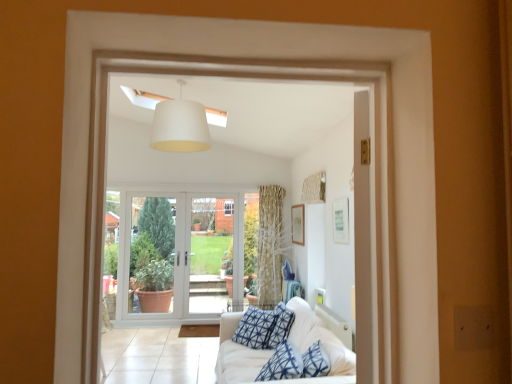
The image size is (512, 384). In order to click on wooden picture frame at upper right, which is the 2th picture frame from right to left in this screenshot , I will do `click(298, 224)`.

What do you see at coordinates (341, 221) in the screenshot? I see `wooden picture frame at upper center, which is the 1th picture frame from front to back` at bounding box center [341, 221].

You are a GUI agent. You are given a task and a screenshot of the screen. Output one action in this format:
    pyautogui.click(x=<x>, y=<y>)
    Task: Click on the white glass door at center
    
    Given the screenshot: What is the action you would take?
    pyautogui.click(x=180, y=256)

What do you see at coordinates (236, 209) in the screenshot? The height and width of the screenshot is (384, 512). I see `white plastic window frame at center` at bounding box center [236, 209].

This screenshot has width=512, height=384. Identify the location of wooden picture frame at upper right, which is the 2th picture frame in front-to-back order. (298, 224).

What's the angular difference between white glass door at center and patterned fabric curtain at upper right's facing directions?

The angle between the facing direction of white glass door at center and the facing direction of patterned fabric curtain at upper right is 89.2 degrees.

Between white glass door at center and patterned fabric curtain at upper right, which one is positioned in front?

patterned fabric curtain at upper right is more forward.

From the image's perspective, which object appears higher, white glass door at center or patterned fabric curtain at upper right?

patterned fabric curtain at upper right, from the image's perspective.

From the image's perspective, is white matte lampshade at upper center located above white glass door at center, the 1th screen door positioned from the right?

Yes, from the image's perspective, white matte lampshade at upper center is on top of white glass door at center, the 1th screen door positioned from the right.

From the picture: How different are the orientations of white matte lampshade at upper center and white glass door at center, which is counted as the 2th screen door, starting from the left, in degrees?

The angle between the facing direction of white matte lampshade at upper center and the facing direction of white glass door at center, which is counted as the 2th screen door, starting from the left, is 87.7 degrees.

This screenshot has height=384, width=512. In order to click on light fixture that is above the white glass door at center, which is counted as the 2th screen door, starting from the left (from the image's perspective) in this screenshot , I will do `click(180, 126)`.

Based on the photo, which is nearer, [203,130] or [207,280]?

Clearly, point [203,130] is closer to the camera than point [207,280].

From a real-world perspective, is white glass door at center physically located above or below white glass door at center, the 1th screen door positioned from the right?

white glass door at center is below white glass door at center, the 1th screen door positioned from the right.

Considering the sizes of white glass door at center and white glass door at center, which is counted as the 2th screen door, starting from the left, in the image, is white glass door at center wider or thinner than white glass door at center, which is counted as the 2th screen door, starting from the left,?

In the image, white glass door at center appears to be wider than white glass door at center, which is counted as the 2th screen door, starting from the left.

In the scene shown: Is white glass door at center bigger or smaller than white glass door at center, which is counted as the 2th screen door, starting from the left?

In the image, white glass door at center appears to be larger than white glass door at center, which is counted as the 2th screen door, starting from the left.

Between patterned fabric curtain at upper right and white matte lampshade at upper center, which one appears on the left side from the viewer's perspective?

white matte lampshade at upper center.

Would you say patterned fabric curtain at upper right contains white matte lampshade at upper center?

That's incorrect, white matte lampshade at upper center is not inside patterned fabric curtain at upper right.

Does patterned fabric curtain at upper right come behind white matte lampshade at upper center?

Yes, patterned fabric curtain at upper right is further from the viewer.

From the image's perspective, who appears lower, patterned fabric curtain at upper right or white matte lampshade at upper center?

From the image's view, patterned fabric curtain at upper right is below.

Which of these two, wooden picture frame at upper right, marked as the 1th picture frame in a left-to-right arrangement, or white glass door at center, stands shorter?

wooden picture frame at upper right, marked as the 1th picture frame in a left-to-right arrangement, is shorter.

From the picture: Would you say wooden picture frame at upper right, which is the 2th picture frame in front-to-back order, is outside white glass door at center?

Yes, wooden picture frame at upper right, which is the 2th picture frame in front-to-back order, is located beyond the bounds of white glass door at center.

This screenshot has height=384, width=512. In order to click on door lying behind the wooden picture frame at upper right, which is the 2th picture frame from right to left in this screenshot , I will do `click(180, 256)`.

Can you tell me how much wooden picture frame at upper right, which is the 2th picture frame in front-to-back order, and white glass door at center differ in facing direction?

89 degrees.

From a real-world perspective, is wooden picture frame at upper right, which is the 2th picture frame in front-to-back order, on top of patterned fabric curtain at upper right?

Actually, wooden picture frame at upper right, which is the 2th picture frame in front-to-back order, is physically below patterned fabric curtain at upper right in the real world.

Which is behind, point (298, 230) or point (317, 176)?

The point (298, 230) is behind.

Consider the image. Is wooden picture frame at upper right, the first picture frame from the back, aimed at patterned fabric curtain at upper right?

No, wooden picture frame at upper right, the first picture frame from the back, is not oriented towards patterned fabric curtain at upper right.

Find the location of `picture frame that is under the white plastic window frame at center (from a real-world perspective)`. picture frame that is under the white plastic window frame at center (from a real-world perspective) is located at coordinates (298, 224).

Between wooden picture frame at upper right, marked as the 1th picture frame in a left-to-right arrangement, and white plastic window frame at center, which one has less height?

wooden picture frame at upper right, marked as the 1th picture frame in a left-to-right arrangement, is shorter.

From the picture: From the image's perspective, which one is positioned lower, wooden picture frame at upper right, the first picture frame from the back, or white plastic window frame at center?

From the image's view, wooden picture frame at upper right, the first picture frame from the back, is below.

The height and width of the screenshot is (384, 512). In the image, there is a patterned fabric curtain at upper right. Identify the location of door below it (from the image's perspective). (180, 256).

Where is `light fixture that is on the right side of white glass door at center, which is counted as the 2th screen door, starting from the left`? light fixture that is on the right side of white glass door at center, which is counted as the 2th screen door, starting from the left is located at coordinates (180, 126).

When comparing their distances from white fabric couch at lower right, does white glass door at center or patterned fabric curtain at upper right seem further?

white glass door at center lies further to white fabric couch at lower right than the other object.

Based on the photo, looking at the image, which one is located closer to white fabric couch at lower right, patterned fabric curtain at upper right or white glass door at center?

Based on the image, patterned fabric curtain at upper right appears to be nearer to white fabric couch at lower right.

Estimate the real-world distances between objects in this image. Which object is closer to white matte lampshade at upper center, clear glass door at center, which ranks as the second screen door in right-to-left order, or wooden picture frame at upper center, placed as the 2th picture frame when sorted from back to front?

Based on the image, wooden picture frame at upper center, placed as the 2th picture frame when sorted from back to front, appears to be nearer to white matte lampshade at upper center.

Looking at the image, which one is located closer to white plastic window frame at center, wooden picture frame at upper right, the first picture frame from the back, or patterned fabric curtain at upper right?

wooden picture frame at upper right, the first picture frame from the back, is closer to white plastic window frame at center.

Based on their spatial positions, is wooden picture frame at upper right, marked as the 1th picture frame in a left-to-right arrangement, or clear glass door at center, the 1th screen door viewed from the left, further from patterned fabric curtain at upper right?

clear glass door at center, the 1th screen door viewed from the left, lies further to patterned fabric curtain at upper right than the other object.

When comparing their distances from wooden picture frame at upper right, marked as the 1th picture frame in a left-to-right arrangement, does white glass door at center or white matte lampshade at upper center seem further?

white matte lampshade at upper center is positioned further to the anchor wooden picture frame at upper right, marked as the 1th picture frame in a left-to-right arrangement.

Considering their positions, is white matte lampshade at upper center positioned closer to patterned fabric curtain at upper right than white fabric couch at lower right?

white fabric couch at lower right is closer to patterned fabric curtain at upper right.

From the image, which object appears to be nearer to patterned fabric curtain at upper right, white fabric couch at lower right or white matte lampshade at upper center?

white fabric couch at lower right lies closer to patterned fabric curtain at upper right than the other object.

This screenshot has width=512, height=384. Find the location of `screen door between white glass door at center and wooden picture frame at upper right, the first picture frame from the back, in the horizontal direction`. screen door between white glass door at center and wooden picture frame at upper right, the first picture frame from the back, in the horizontal direction is located at coordinates (211, 253).

You are a GUI agent. You are given a task and a screenshot of the screen. Output one action in this format:
    pyautogui.click(x=<x>, y=<y>)
    Task: Click on the door located between white matte lampshade at upper center and clear glass door at center, the 1th screen door viewed from the left, in the depth direction
    The image size is (512, 384).
    Given the screenshot: What is the action you would take?
    pyautogui.click(x=180, y=256)

Where is `curtain between white fabric couch at lower right and clear glass door at center, which ranks as the second screen door in right-to-left order, from front to back`? The width and height of the screenshot is (512, 384). curtain between white fabric couch at lower right and clear glass door at center, which ranks as the second screen door in right-to-left order, from front to back is located at coordinates (314, 189).

Where is `picture frame located between clear glass door at center, which ranks as the second screen door in right-to-left order, and patterned fabric curtain at upper right in the left-right direction`? The image size is (512, 384). picture frame located between clear glass door at center, which ranks as the second screen door in right-to-left order, and patterned fabric curtain at upper right in the left-right direction is located at coordinates (298, 224).